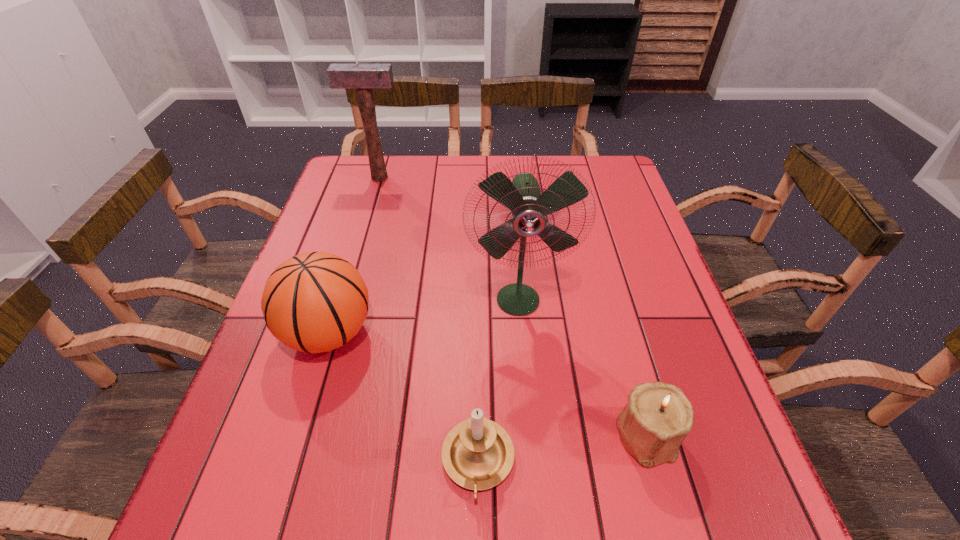
At what (x,y) coordinates should I click in order to perform the action: click on object that is the third closest to the left candle_holder. Please return your answer as a coordinate pair (x, y). Looking at the image, I should click on (529, 208).

Identify the location of object that can be found as the third closest to the rightmost object. pos(314,302).

Locate an element on the screen. This screenshot has width=960, height=540. free point that satisfies the following two spatial constraints: 1. on the back side of the farthest object; 2. on the left side of the third shortest object is located at coordinates (376, 178).

Find the location of a particular element. The width and height of the screenshot is (960, 540). free location that satisfies the following two spatial constraints: 1. on the front-facing side of the fan; 2. on the left side of the right candle_holder is located at coordinates (529, 435).

Identify the location of blank area in the image that satisfies the following two spatial constraints: 1. on the front side of the basketball; 2. on the left side of the right candle_holder. (299, 435).